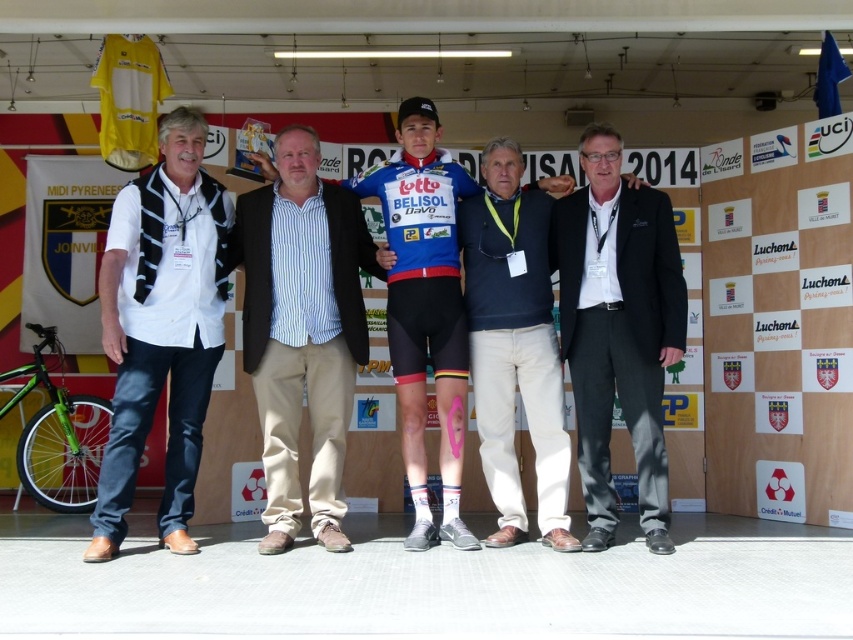
You are a photographer at the event. You need to capture a photo where the dark blue cotton shirt at center and the blue jersey at center are both visible. Based on their positions, which one will appear lower in the photo?

The dark blue cotton shirt at center is below the blue jersey at center, so it will appear lower in the photo.

You are a photographer standing at the front of the podium. You need to capture a closeup shot of both the striped cotton shirt at center and the blue jersey at center without moving your camera. Can you do it?

The striped cotton shirt at center is 23.77 inches away from the blue jersey at center. Since the distance between them is relatively small, it is possible to capture both in a single closeup shot without moving the camera by adjusting the zoom or framing appropriately.